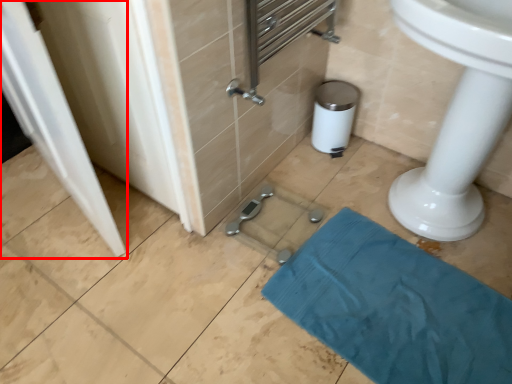
Question: From the image's perspective, what is the correct spatial positioning of screen door (annotated by the red box) in reference to bath towel?

Choices:
 (A) below
 (B) above

Answer: (B)